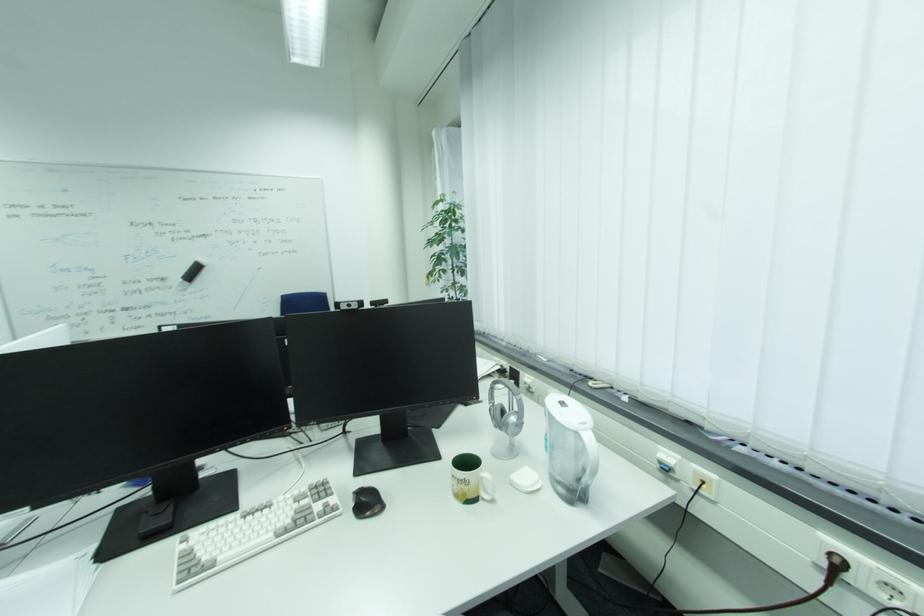
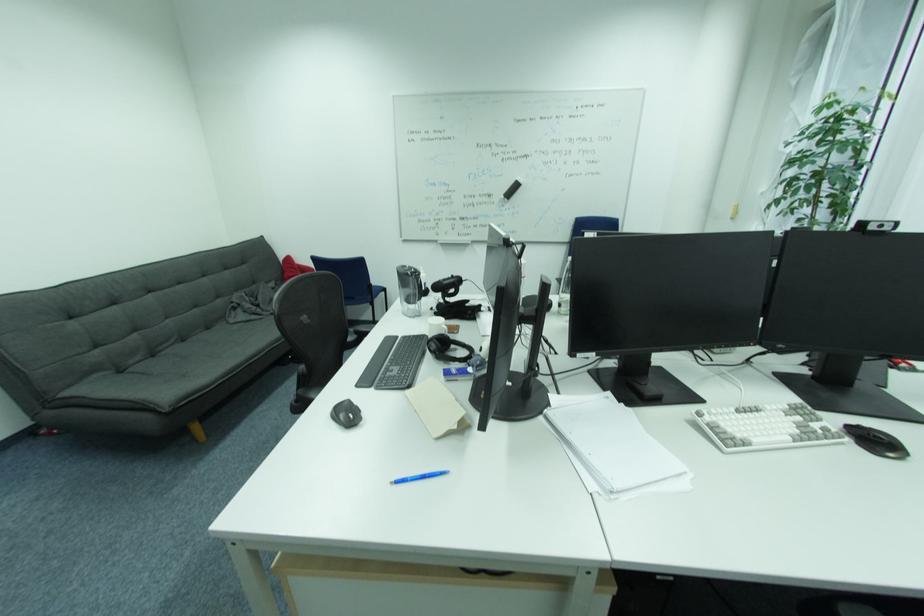
Question: How did the camera likely rotate?

Choices:
 (A) Left
 (B) Right
 (C) Up
 (D) Down

Answer: (A)